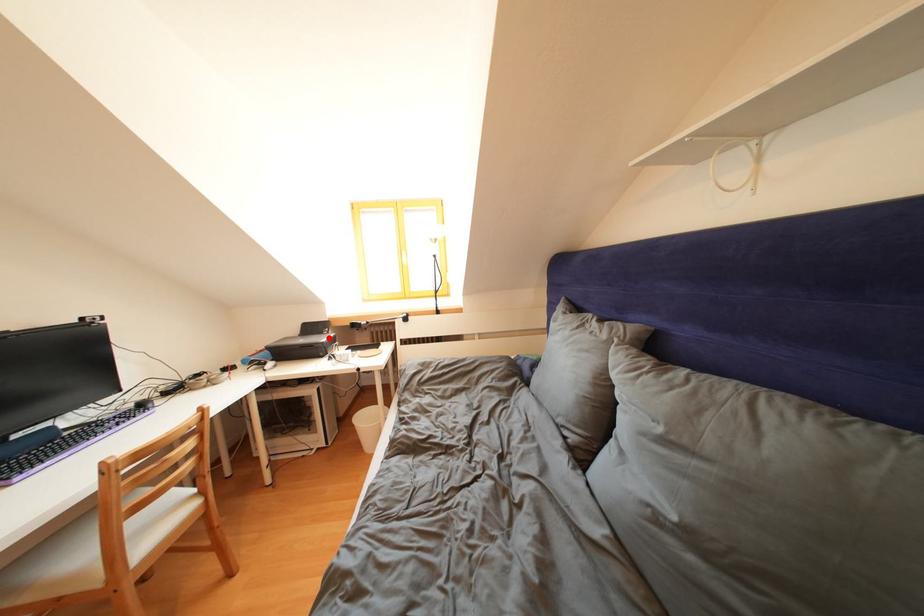
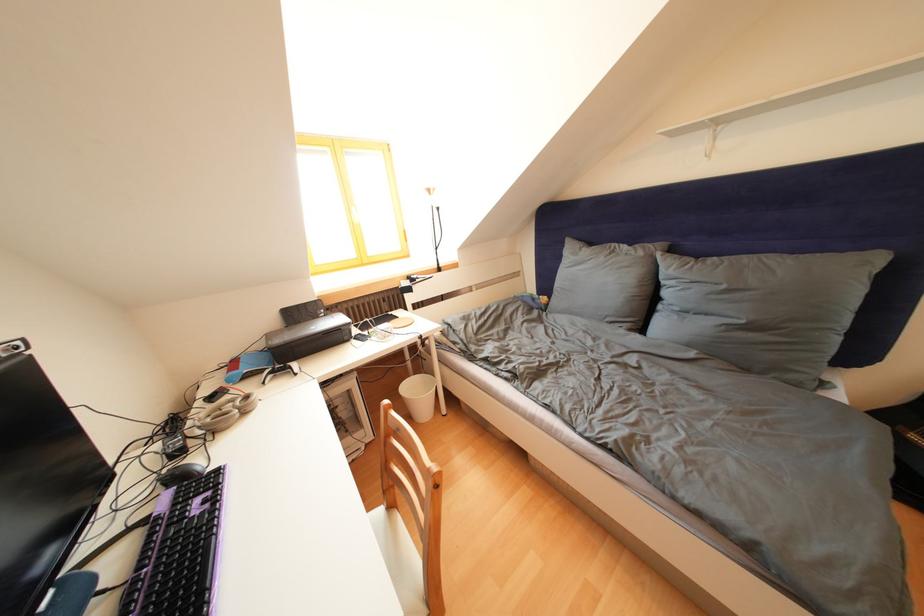
Find the pixel in the second image that matches the highlighted location in the first image.

(323, 322)